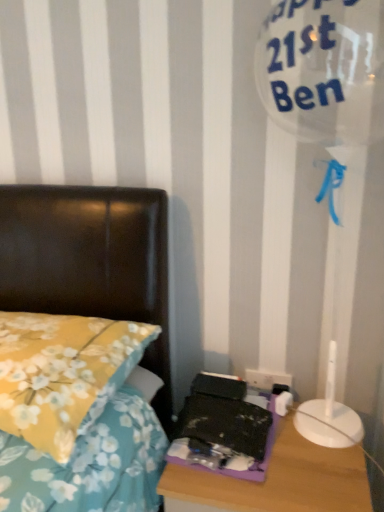
Question: From the image's perspective, would you say white plastic electric outlet at lower right is shown under yellow floral fabric pillow at left?

Choices:
 (A) yes
 (B) no

Answer: (A)

Question: Is white plastic electric outlet at lower right far from yellow floral fabric pillow at left?

Choices:
 (A) no
 (B) yes

Answer: (A)

Question: Does white plastic electric outlet at lower right have a greater width compared to yellow floral fabric pillow at left?

Choices:
 (A) no
 (B) yes

Answer: (A)

Question: Does white plastic electric outlet at lower right have a larger size compared to yellow floral fabric pillow at left?

Choices:
 (A) no
 (B) yes

Answer: (A)

Question: Can you confirm if white plastic electric outlet at lower right is smaller than yellow floral fabric pillow at left?

Choices:
 (A) no
 (B) yes

Answer: (B)

Question: Can you confirm if white plastic electric outlet at lower right is shorter than yellow floral fabric pillow at left?

Choices:
 (A) yes
 (B) no

Answer: (A)

Question: Considering the relative sizes of yellow floral fabric pillow at left and purple plastic nightstand at lower right in the image provided, is yellow floral fabric pillow at left wider than purple plastic nightstand at lower right?

Choices:
 (A) no
 (B) yes

Answer: (B)

Question: Is yellow floral fabric pillow at left shorter than purple plastic nightstand at lower right?

Choices:
 (A) no
 (B) yes

Answer: (B)

Question: Is yellow floral fabric pillow at left smaller than purple plastic nightstand at lower right?

Choices:
 (A) no
 (B) yes

Answer: (B)

Question: From the image's perspective, is yellow floral fabric pillow at left below purple plastic nightstand at lower right?

Choices:
 (A) no
 (B) yes

Answer: (A)

Question: Is yellow floral fabric pillow at left located outside purple plastic nightstand at lower right?

Choices:
 (A) yes
 (B) no

Answer: (A)

Question: From a real-world perspective, is yellow floral fabric pillow at left on purple plastic nightstand at lower right?

Choices:
 (A) no
 (B) yes

Answer: (B)

Question: Considering the relative sizes of white plastic electric outlet at lower right and purple plastic nightstand at lower right in the image provided, is white plastic electric outlet at lower right thinner than purple plastic nightstand at lower right?

Choices:
 (A) yes
 (B) no

Answer: (A)